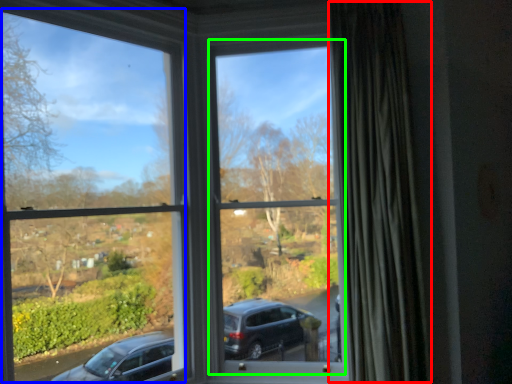
Question: Considering the real-world distances, which object is closest to curtain (highlighted by a red box)? window frame (highlighted by a blue box) or window frame (highlighted by a green box).

Choices:
 (A) window frame
 (B) window frame

Answer: (B)